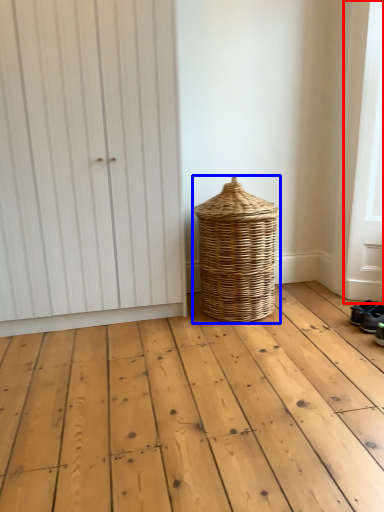
Question: Among these objects, which one is nearest to the camera, screen door (highlighted by a red box) or basket (highlighted by a blue box)?

Choices:
 (A) screen door
 (B) basket

Answer: (A)